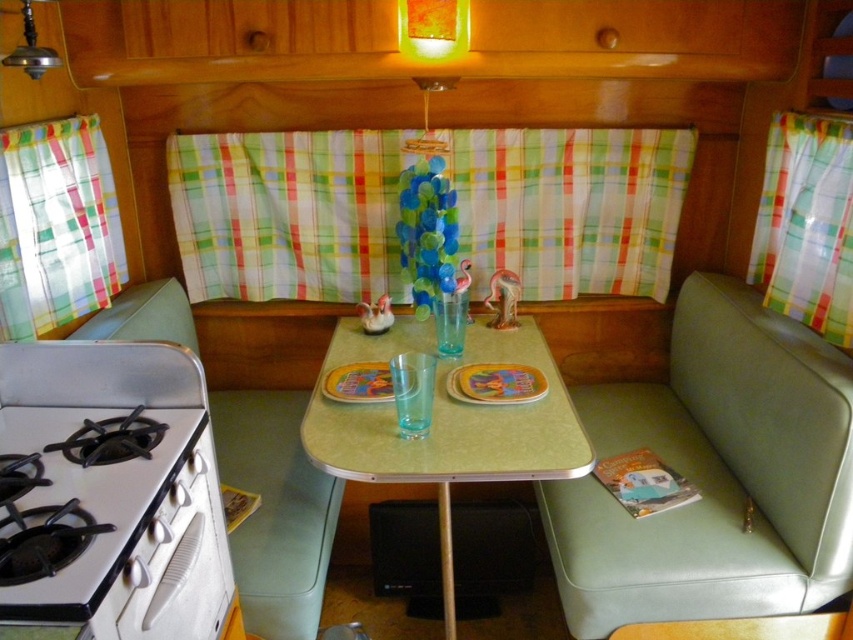
From the picture: You are planning to place a rectangular box that is 1.2 meters wide on the yellow matte plate at center. The green vinyl couch at lower right is next to it. Can the box fit on the plate without overlapping the couch?

The green vinyl couch at lower right is wider than the yellow matte plate at center. Since the box is 1.2 meters wide, it may not fit on the plate without overlapping the couch because the plate is narrower than the couch.

Where is the green vinyl couch at lower right located in the image?

The green vinyl couch at lower right is located at point (714,474) in the image.